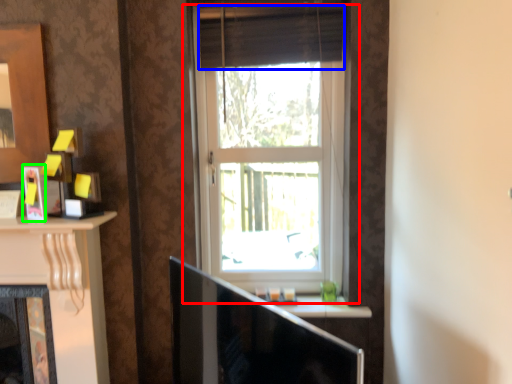
Question: Estimate the real-world distances between objects in this image. Which object is farther from window (highlighted by a red box), curtain (highlighted by a blue box) or picture frame (highlighted by a green box)?

Choices:
 (A) curtain
 (B) picture frame

Answer: (B)